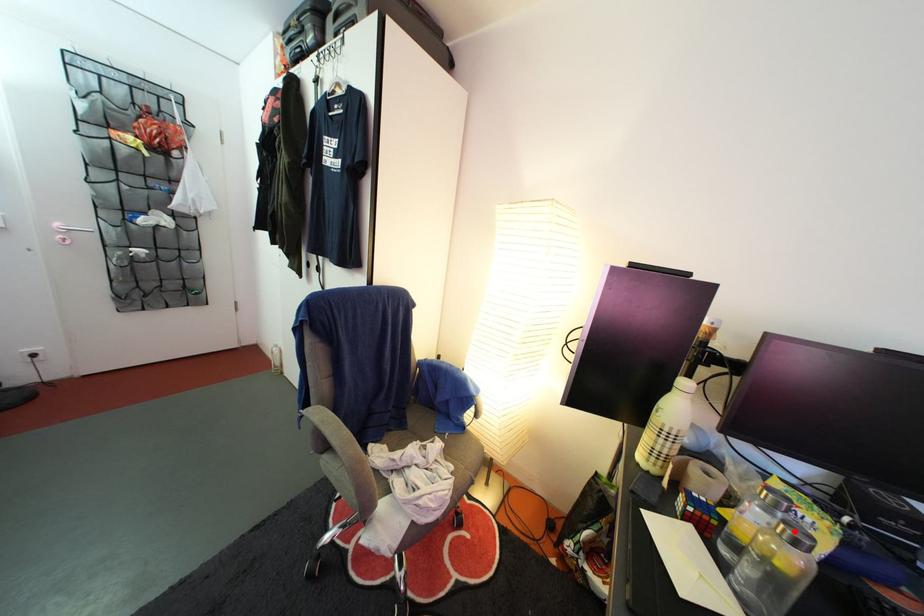
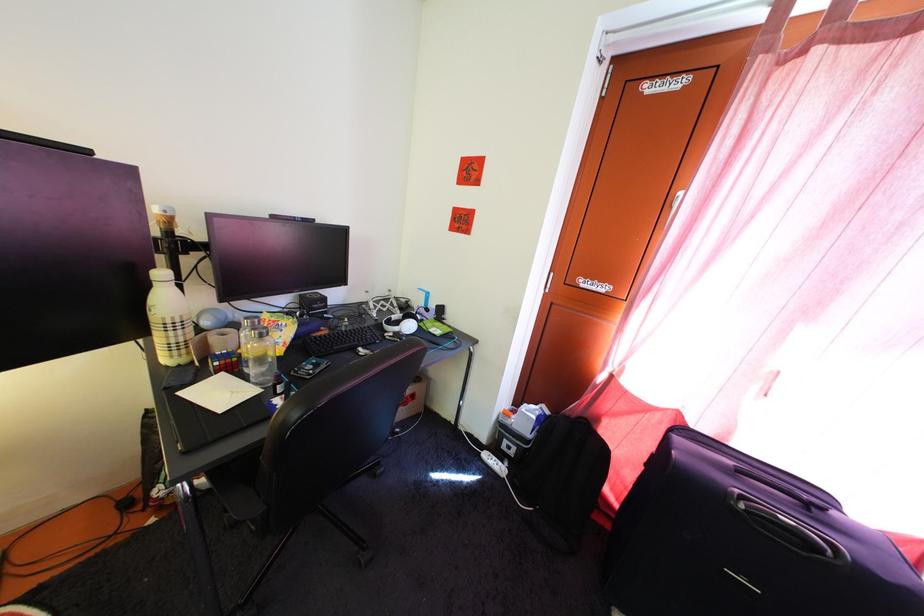
Where in the second image is the point corresponding to the highlighted location from the first image?

(262, 338)